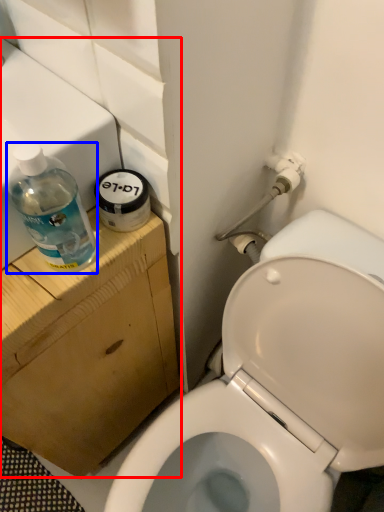
Question: Which object is further to the camera taking this photo, sink (highlighted by a red box) or bottle (highlighted by a blue box)?

Choices:
 (A) sink
 (B) bottle

Answer: (A)